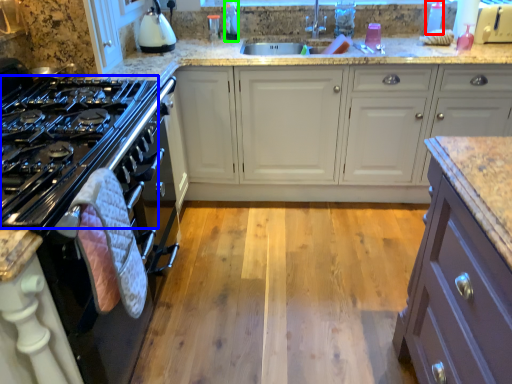
Question: Based on their relative distances, which object is nearer to bottle (highlighted by a red box)? Choose from gas stove (highlighted by a blue box) and bottle (highlighted by a green box).

Choices:
 (A) gas stove
 (B) bottle

Answer: (B)